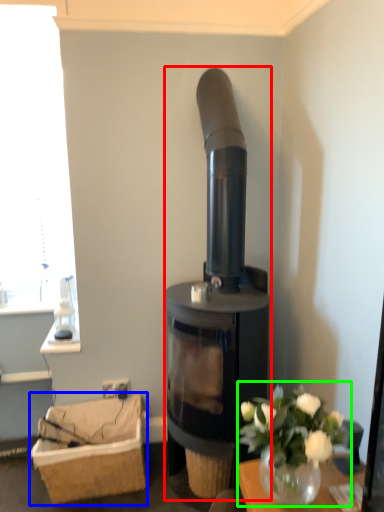
Question: Which object is the closest to the wood burning stove (highlighted by a red box)? Choose among these: basket (highlighted by a blue box) or floral arrangement (highlighted by a green box).

Choices:
 (A) basket
 (B) floral arrangement

Answer: (A)